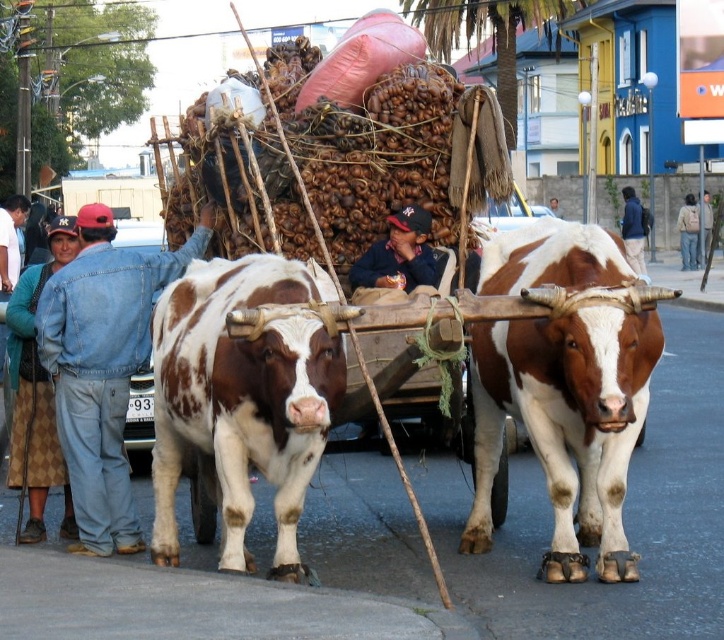
You are a photographer trying to capture both the brown and white textured bull at center and the brown spotted hide at center in a single shot. Given their sizes, which one would you need to position closer to the camera to ensure both fit in the frame?

The brown spotted hide at center is smaller in size than the brown and white textured bull at center. To fit both in the frame, position the brown spotted hide at center closer to the camera since it is smaller and requires less space, while the larger bull can be placed farther back to maintain proportion.

You are a photographer standing on the street and see the brown spotted hide at center and the blue denim jacket at center in the scene. Which object is positioned more to the left?

The brown spotted hide at center is positioned to the left of the blue denim jacket at center, so it is more to the left.

Consider the image. You are a photographer positioned at the origin point. The brown and white textured bull at center is located at point 0.605, 0.780. Which direction should you move to capture the bull in your shot?

The brown and white textured bull at center is located at point (564, 387). To capture it in your shot, you should move towards the direction of the coordinates provided, which is northeast if the coordinate system assumes the origin is at the bottom left corner.